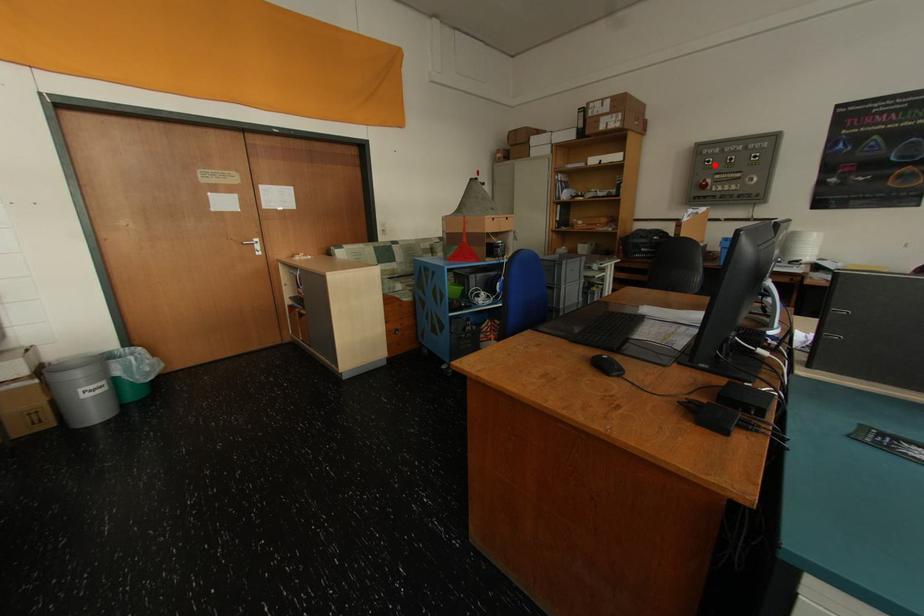
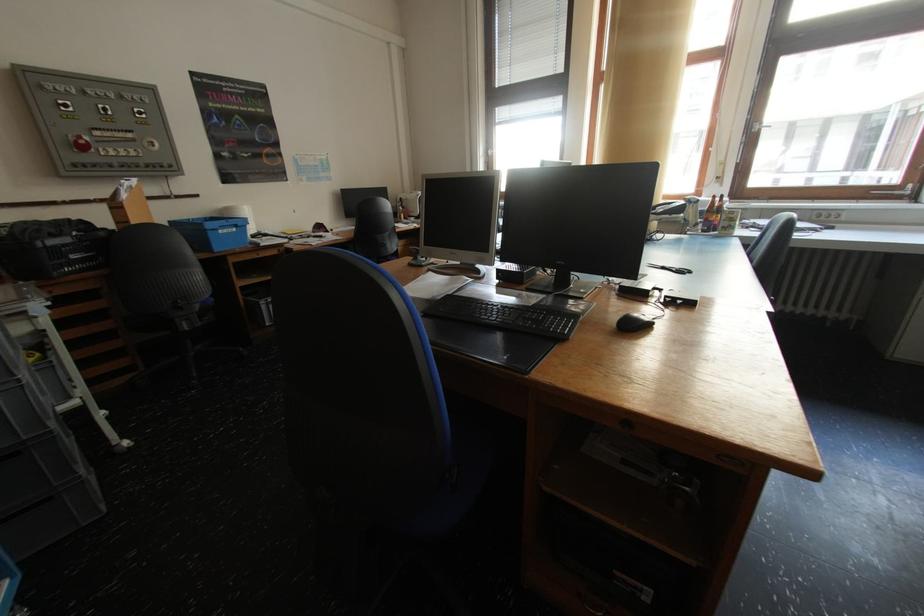
In the second image, find the point that corresponds to the highlighted location in the first image.

(71, 110)